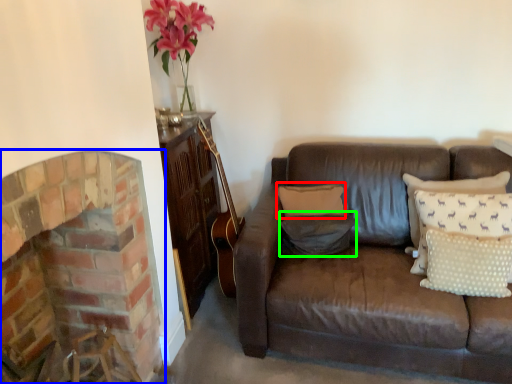
Question: Which is farther away from pillow (highlighted by a red box)? fireplace (highlighted by a blue box) or pillow (highlighted by a green box)?

Choices:
 (A) fireplace
 (B) pillow

Answer: (A)